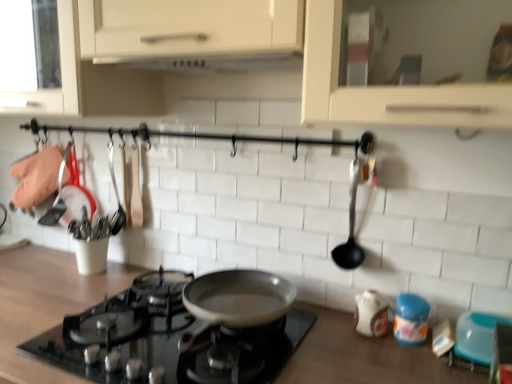
Identify the location of free spot in front of blue plastic container at lower right, marked as the second appliance in a right-to-left arrangement. (417, 364).